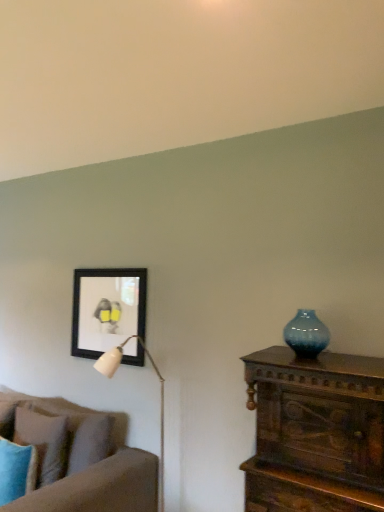
Question: From a real-world perspective, does matte blue pillow at lower left, which is the 1th pillow from front to back, sit lower than soft brown fabric couch at left?

Choices:
 (A) yes
 (B) no

Answer: (B)

Question: Does matte blue pillow at lower left, marked as the second pillow in a back-to-front arrangement, appear on the left side of soft brown fabric couch at left?

Choices:
 (A) yes
 (B) no

Answer: (B)

Question: Is the surface of matte blue pillow at lower left, marked as the second pillow in a back-to-front arrangement, in direct contact with soft brown fabric couch at left?

Choices:
 (A) no
 (B) yes

Answer: (A)

Question: Is matte blue pillow at lower left, marked as the second pillow in a back-to-front arrangement, wider than soft brown fabric couch at left?

Choices:
 (A) yes
 (B) no

Answer: (B)

Question: Is matte blue pillow at lower left, marked as the second pillow in a back-to-front arrangement, positioned with its back to soft brown fabric couch at left?

Choices:
 (A) no
 (B) yes

Answer: (B)

Question: From the image's perspective, relative to matte blue pillow at lower left, which is the 1th pillow from front to back, is black matte picture frame at upper left above or below?

Choices:
 (A) below
 (B) above

Answer: (B)

Question: Considering the positions of black matte picture frame at upper left and matte blue pillow at lower left, marked as the second pillow in a back-to-front arrangement, in the image, is black matte picture frame at upper left taller or shorter than matte blue pillow at lower left, marked as the second pillow in a back-to-front arrangement,?

Choices:
 (A) tall
 (B) short

Answer: (A)

Question: Considering the positions of black matte picture frame at upper left and matte blue pillow at lower left, marked as the second pillow in a back-to-front arrangement, in the image, is black matte picture frame at upper left wider or thinner than matte blue pillow at lower left, marked as the second pillow in a back-to-front arrangement,?

Choices:
 (A) thin
 (B) wide

Answer: (A)

Question: Would you say black matte picture frame at upper left is inside or outside matte blue pillow at lower left, which is the 1th pillow from front to back?

Choices:
 (A) inside
 (B) outside

Answer: (B)

Question: Considering the positions of point [x=96, y=310] and point [x=147, y=352], is point [x=96, y=310] closer or farther from the camera than point [x=147, y=352]?

Choices:
 (A) farther
 (B) closer

Answer: (A)

Question: Is black matte picture frame at upper left spatially inside white glossy table lamp at upper left, or outside of it?

Choices:
 (A) outside
 (B) inside

Answer: (A)

Question: From the image's perspective, is black matte picture frame at upper left above or below white glossy table lamp at upper left?

Choices:
 (A) above
 (B) below

Answer: (A)

Question: In terms of size, does black matte picture frame at upper left appear bigger or smaller than white glossy table lamp at upper left?

Choices:
 (A) small
 (B) big

Answer: (A)

Question: Does point (117, 326) appear closer or farther from the camera than point (284, 326)?

Choices:
 (A) closer
 (B) farther

Answer: (B)

Question: From a real-world perspective, relative to blue glass vase at right, is black matte picture frame at upper left vertically above or below?

Choices:
 (A) below
 (B) above

Answer: (A)